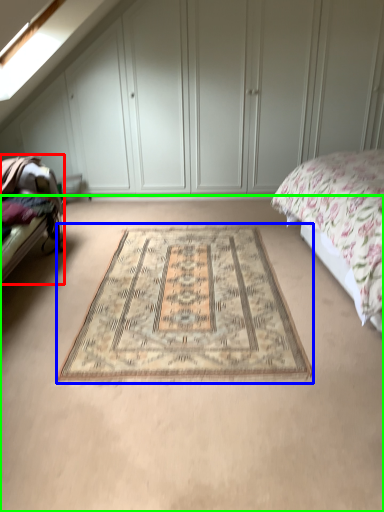
Question: Estimate the real-world distances between objects in this image. Which object is closer to bed frame (highlighted by a red box), mat (highlighted by a blue box) or plain (highlighted by a green box)?

Choices:
 (A) mat
 (B) plain

Answer: (B)